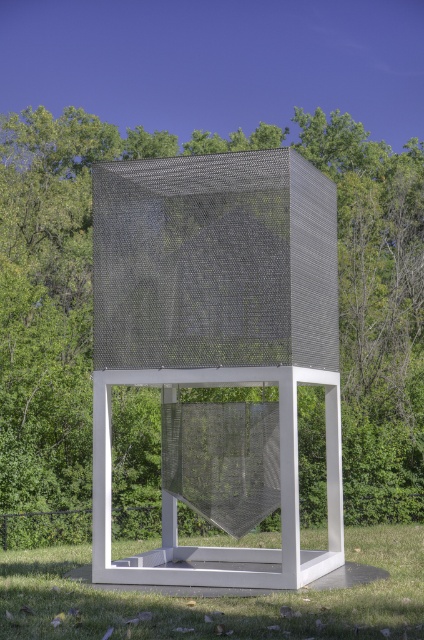
Based on the photo, you are a landscape architect designing a garden around the sculpture. Considering the sizes of the metal mesh cube at center and the green grass at lower center, which one should you prioritize in terms of space allocation for maintenance access?

The green grass at lower center is larger than the metal mesh cube at center, so you should prioritize allocating more space for maintenance access around the green grass at lower center.

You are standing in front of the modern sculpture described. The point marked at coordinates (217, 330) is labeled as the metal mesh cube at center. Can you confirm if this point is indeed at the center of the cube?

Yes, the point marked at coordinates (217, 330) is indeed at the center of the metal mesh cube as described in the scene.